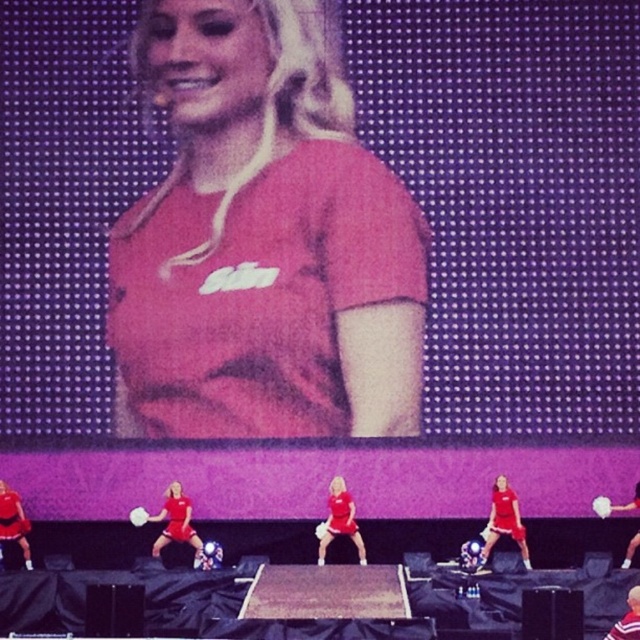
Who is lower down, matte red shorts at lower center or matte red shorts at center?

Positioned lower is matte red shorts at lower center.

Does matte red shorts at lower center have a larger size compared to matte red shorts at center?

Correct, matte red shorts at lower center is larger in size than matte red shorts at center.

Find the location of a particular element. matte red shorts at lower center is located at coordinates (176, 522).

Is matte red shorts at center closer to the viewer compared to matte red shorts at lower left?

Yes, matte red shorts at center is in front of matte red shorts at lower left.

Between matte red shorts at center and matte red shorts at lower left, which one appears on the right side from the viewer's perspective?

matte red shorts at center is more to the right.

The height and width of the screenshot is (640, 640). What do you see at coordinates (340, 520) in the screenshot?
I see `matte red shorts at center` at bounding box center [340, 520].

Image resolution: width=640 pixels, height=640 pixels. What are the coordinates of `matte red shorts at center` in the screenshot? It's located at (340, 520).

Who is more forward, (179, 506) or (4, 490)?

Positioned in front is point (179, 506).

Locate an element on the screen. The image size is (640, 640). matte red shorts at lower center is located at coordinates pyautogui.click(x=176, y=522).

I want to click on matte red shorts at lower center, so click(176, 522).